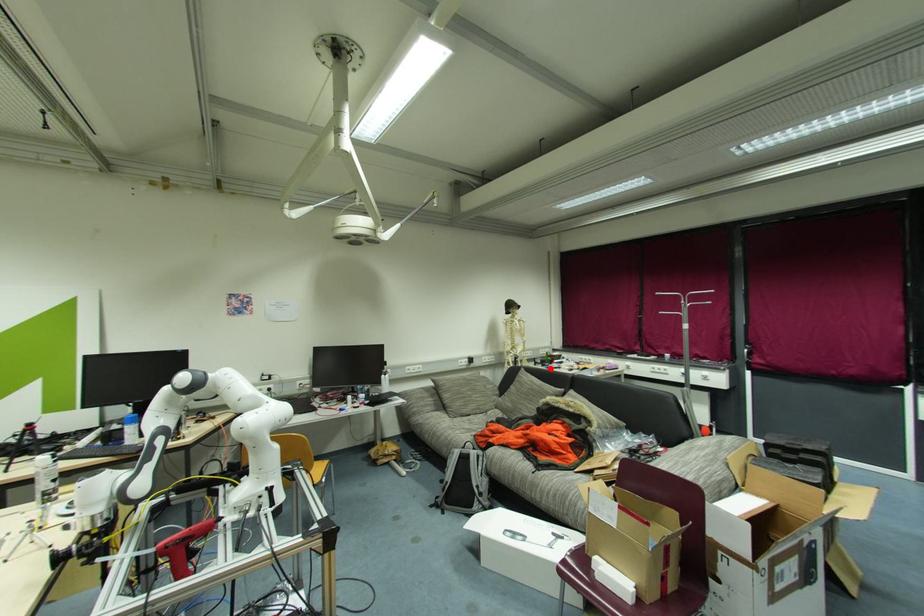
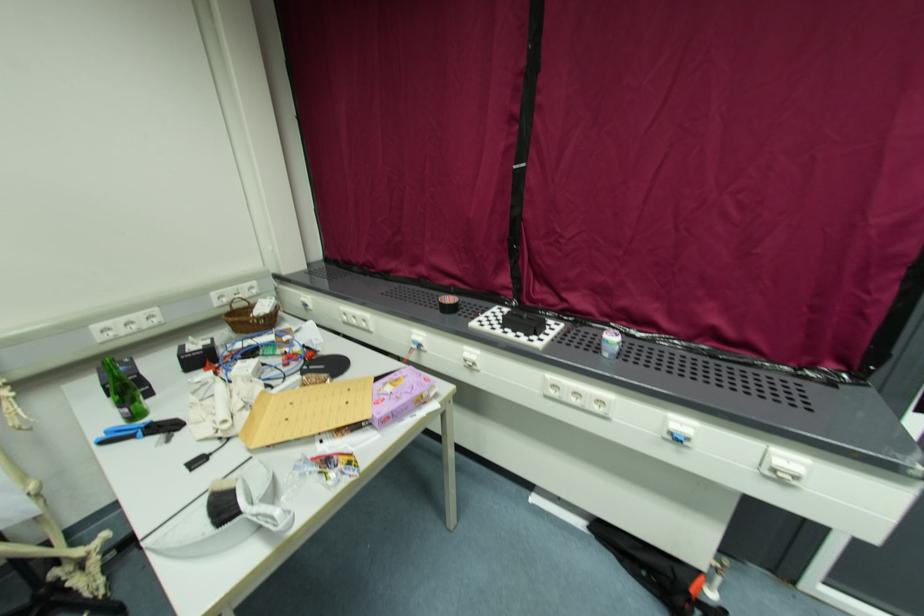
In the second image, find the point that corresponds to the highlighted location in the first image.

(107, 443)